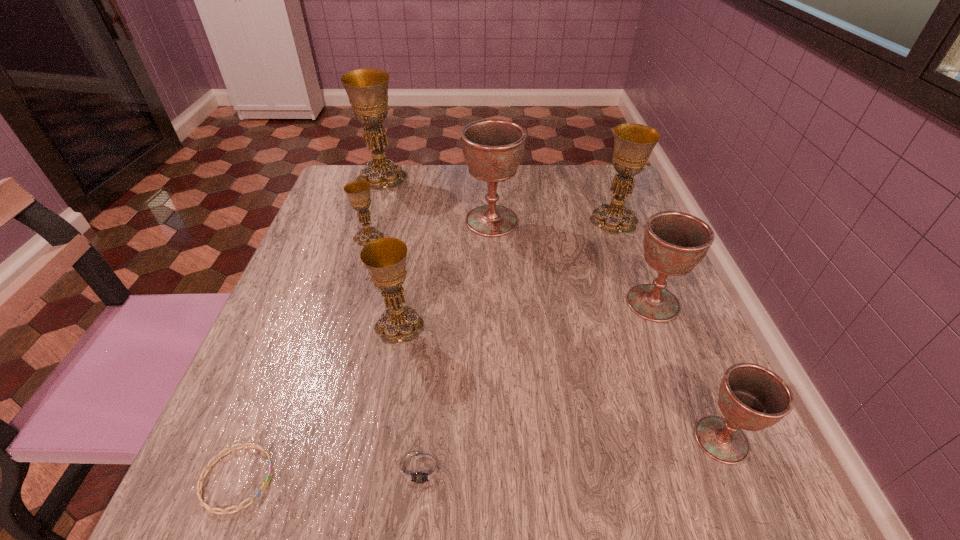
Locate an element on the screen. The width and height of the screenshot is (960, 540). brown chalice that is the third closest to the second biggest gold chalice is located at coordinates (751, 397).

Identify which brown chalice is the nearest to the nearest chalice. Please provide its 2D coordinates. Your answer should be formatted as a tuple, i.e. [(x, y)], where the tuple contains the x and y coordinates of a point satisfying the conditions above.

[(674, 242)]

Locate an element on the screen. free spot that satisfies the following two spatial constraints: 1. on the front side of the third chalice from left to right; 2. on the left side of the tallest chalice is located at coordinates (336, 326).

Where is `vacant point that satisfies the following two spatial constraints: 1. on the face of the watch; 2. on the surface of the shortest object showing star-shaped elements`? vacant point that satisfies the following two spatial constraints: 1. on the face of the watch; 2. on the surface of the shortest object showing star-shaped elements is located at coordinates (421, 478).

Locate an element on the screen. The height and width of the screenshot is (540, 960). vacant space that satisfies the following two spatial constraints: 1. on the front side of the farthest chalice; 2. on the left side of the biggest brown chalice is located at coordinates (369, 221).